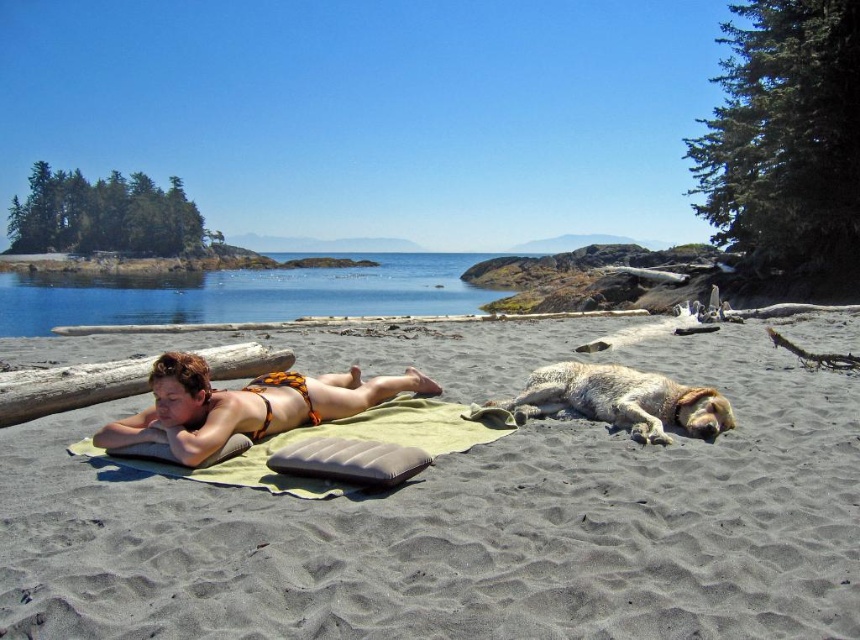
Is orange bikini at center further to the viewer compared to green fabric towel at center?

Yes, orange bikini at center is further from the viewer.

From the picture: Is orange bikini at center shorter than green fabric towel at center?

In fact, orange bikini at center may be taller than green fabric towel at center.

At what (x,y) coordinates should I click in order to perform the action: click on orange bikini at center. Please return your answer as a coordinate pair (x, y). This screenshot has height=640, width=860. Looking at the image, I should click on (244, 404).

Locate an element on the screen. orange bikini at center is located at coordinates (244, 404).

Is orange bikini at center below brown wood log at left?

Yes, orange bikini at center is below brown wood log at left.

Describe the element at coordinates (244, 404) in the screenshot. I see `orange bikini at center` at that location.

The height and width of the screenshot is (640, 860). What are the coordinates of `orange bikini at center` in the screenshot? It's located at (244, 404).

Identify the location of dark brown sand at center. Image resolution: width=860 pixels, height=640 pixels. (467, 531).

Is dark brown sand at center to the right of fuzzy white dog at lower right from the viewer's perspective?

No, dark brown sand at center is not to the right of fuzzy white dog at lower right.

Does point (634, 506) come closer to viewer compared to point (538, 406)?

Yes, it is in front of point (538, 406).

In order to click on dark brown sand at center in this screenshot , I will do `click(467, 531)`.